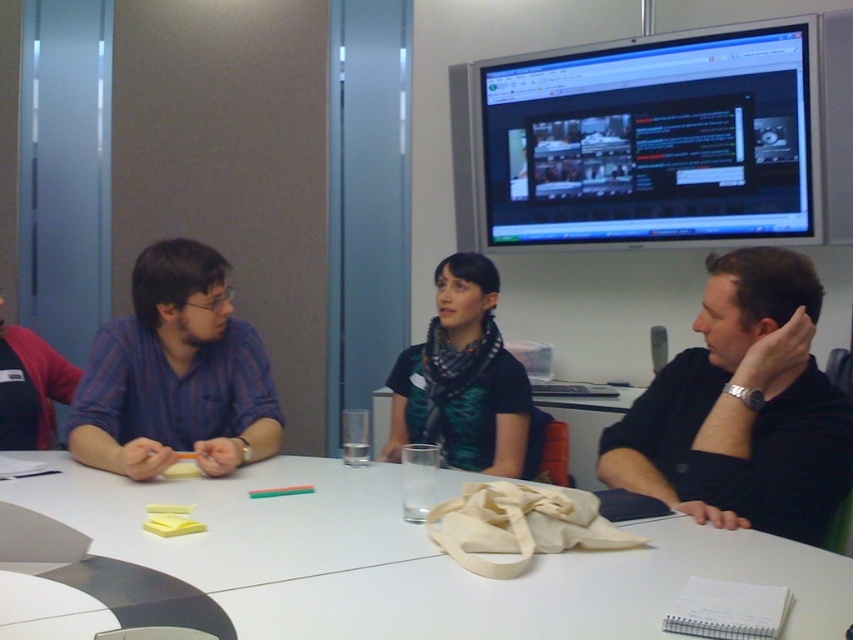
Question: Which object is farther from the camera taking this photo?

Choices:
 (A) black scarf at center
 (B) blue striped shirt at left

Answer: (A)

Question: Is black glossy monitor at upper right to the left of black matte shirt at right from the viewer's perspective?

Choices:
 (A) yes
 (B) no

Answer: (B)

Question: Is white matte table at center to the left of blue striped shirt at left from the viewer's perspective?

Choices:
 (A) no
 (B) yes

Answer: (A)

Question: Which point appears closest to the camera in this image?

Choices:
 (A) (277, 406)
 (B) (450, 257)
 (C) (509, 176)

Answer: (A)

Question: Which of these objects is positioned closest to the white matte table at center?

Choices:
 (A) black scarf at center
 (B) black matte shirt at right
 (C) blue striped shirt at left
 (D) black glossy monitor at upper right

Answer: (C)

Question: Can you confirm if black glossy monitor at upper right is positioned above blue striped shirt at left?

Choices:
 (A) no
 (B) yes

Answer: (B)